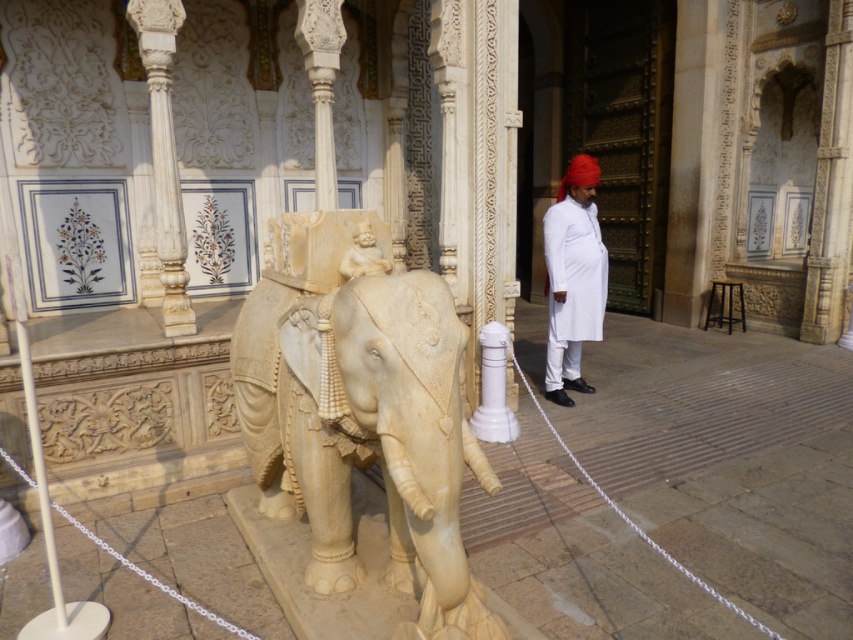
You are an art conservator examining the sculpture of the white marble elephant at center and the white cotton turban at right. Which object is positioned nearer to your viewpoint?

The white marble elephant at center is closer to the viewer than the white cotton turban at right, so the white marble elephant at center is nearer to your viewpoint.

You are an architect examining the sculpture of the white marble elephant at center and the white cotton turban at right. Which object is shorter in height?

The white marble elephant at center is shorter in height compared to the white cotton turban at right.

You are an architect designing a new exhibit space and need to place the white marble elephant at center and the white cotton turban at right in the same display area. Given their sizes, which object will require more horizontal space for proper placement?

The white marble elephant at center requires more horizontal space because its width surpasses that of the white cotton turban at right.